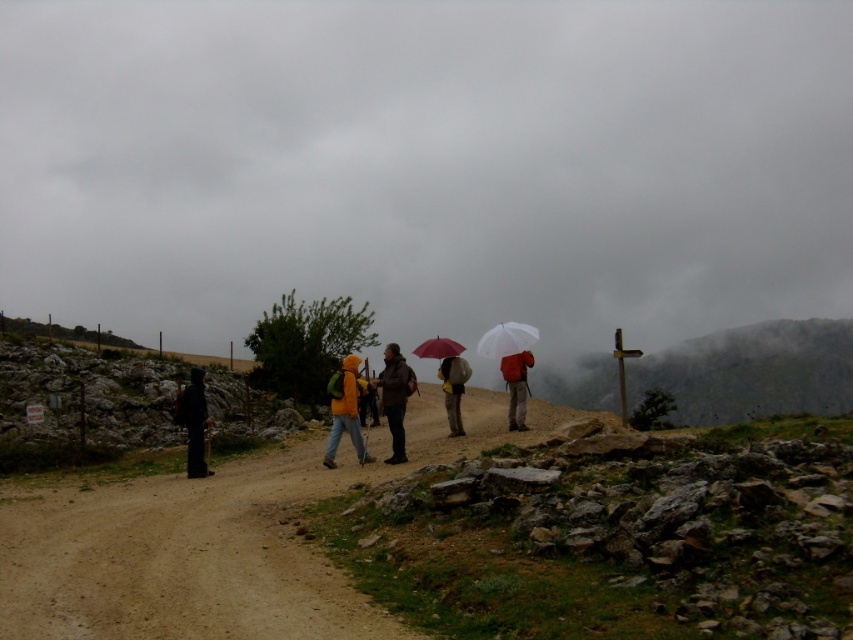
Question: Is orange waterproof jacket at center to the left of matte gray backpack at center from the viewer's perspective?

Choices:
 (A) yes
 (B) no

Answer: (A)

Question: Which object is the closest to the matte red umbrella at center?

Choices:
 (A) matte red backpack at center
 (B) matte gray backpack at center

Answer: (B)

Question: Which point is farther from the camera taking this photo?

Choices:
 (A) (387, 364)
 (B) (222, 314)
 (C) (447, 342)

Answer: (B)

Question: From the image, what is the correct spatial relationship of dirt track at center in relation to brown leather jacket at center?

Choices:
 (A) left
 (B) right

Answer: (B)

Question: Is orange waterproof jacket at center to the right of matte red backpack at center from the viewer's perspective?

Choices:
 (A) yes
 (B) no

Answer: (B)

Question: Which point is farther to the camera?

Choices:
 (A) orange waterproof jacket at center
 (B) matte red umbrella at center
 (C) dirt track at center

Answer: (B)